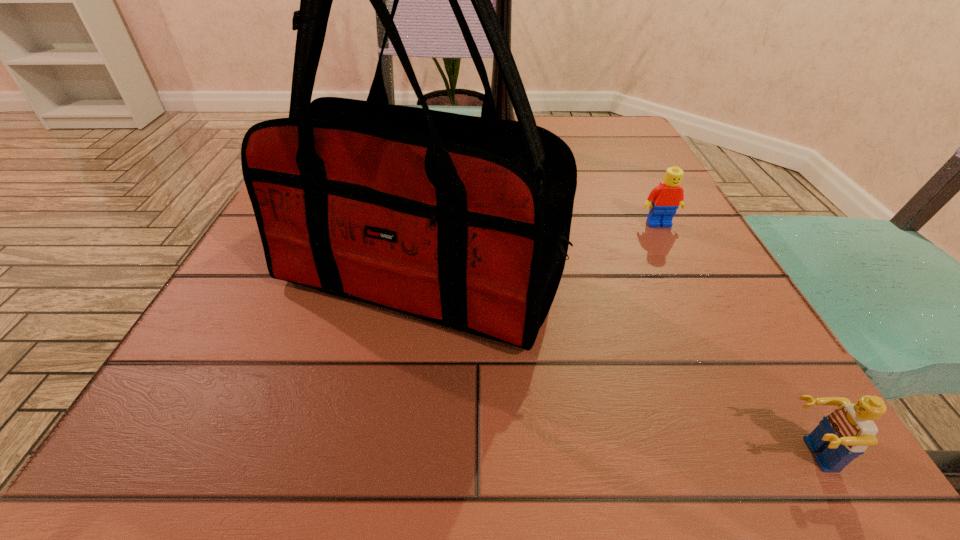
This screenshot has width=960, height=540. I want to click on the tallest object, so click(503, 6).

What are the coordinates of `table lamp` in the screenshot? It's located at (503, 6).

Identify the location of the third shortest object. The image size is (960, 540). (463, 221).

The width and height of the screenshot is (960, 540). Find the location of `the farther Lego`. the farther Lego is located at coordinates (666, 198).

The width and height of the screenshot is (960, 540). Identify the location of the nearest object. (844, 434).

You are a GUI agent. You are given a task and a screenshot of the screen. Output one action in this format:
    pyautogui.click(x=<x>, y=<y>)
    Task: Click on the free space located on the left of the tallest object
    This screenshot has width=960, height=540.
    Given the screenshot: What is the action you would take?
    pyautogui.click(x=342, y=143)

Locate an element on the screen. This screenshot has width=960, height=540. vacant space situated on the back of the second tallest object is located at coordinates (433, 205).

Where is `vacant space situated 0.330m on the face of the farther Lego`? This screenshot has height=540, width=960. vacant space situated 0.330m on the face of the farther Lego is located at coordinates (745, 390).

Locate an element on the screen. Image resolution: width=960 pixels, height=540 pixels. vacant region located on the face of the nearer Lego is located at coordinates (538, 454).

You are a GUI agent. You are given a task and a screenshot of the screen. Output one action in this format:
    pyautogui.click(x=<x>, y=<y>)
    Task: Click on the free spot located on the face of the nearer Lego
    The height and width of the screenshot is (540, 960).
    Given the screenshot: What is the action you would take?
    pyautogui.click(x=735, y=454)